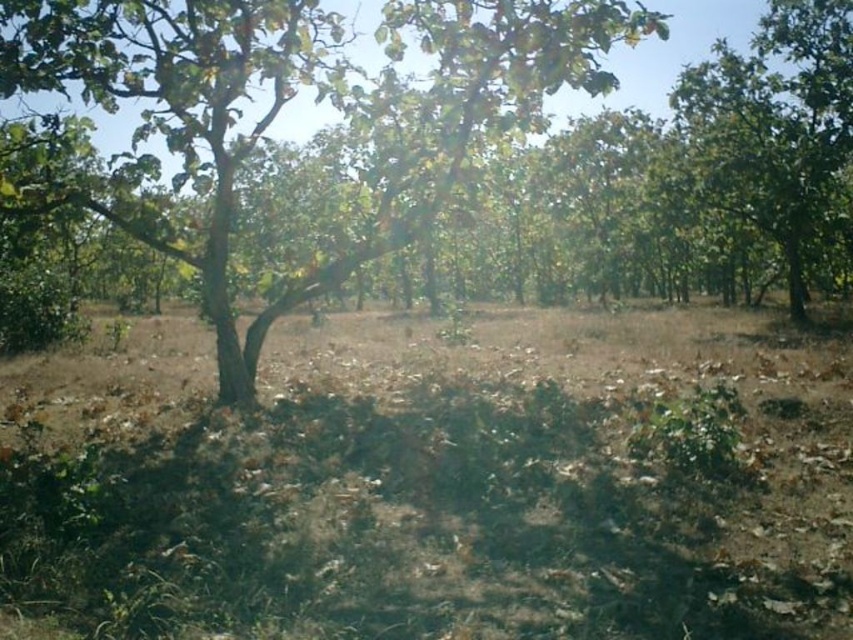
Between point (329, 42) and point (763, 179), which one is positioned behind?

Positioned behind is point (763, 179).

Find the location of `green leafy tree at center`. green leafy tree at center is located at coordinates (294, 92).

Locate an element on the screen. This screenshot has width=853, height=640. green leafy tree at center is located at coordinates (294, 92).

Does brown dry dirt at center have a greater width compared to green leafy tree at upper right?

Indeed, brown dry dirt at center has a greater width compared to green leafy tree at upper right.

Between brown dry dirt at center and green leafy tree at upper right, which one is positioned higher?

green leafy tree at upper right is higher up.

Is point (387, 589) behind point (791, 28)?

No, (387, 589) is closer to viewer.

Find the location of a particular element. brown dry dirt at center is located at coordinates (433, 483).

In the scene shown: Can you confirm if brown dry dirt at center is shorter than green leafy tree at center?

Indeed, brown dry dirt at center has a lesser height compared to green leafy tree at center.

In the scene shown: Can you confirm if brown dry dirt at center is positioned to the left of green leafy tree at center?

No, brown dry dirt at center is not to the left of green leafy tree at center.

Which is behind, point (231, 538) or point (271, 120)?

The point (271, 120) is more distant.

The width and height of the screenshot is (853, 640). In order to click on brown dry dirt at center in this screenshot , I will do `click(433, 483)`.